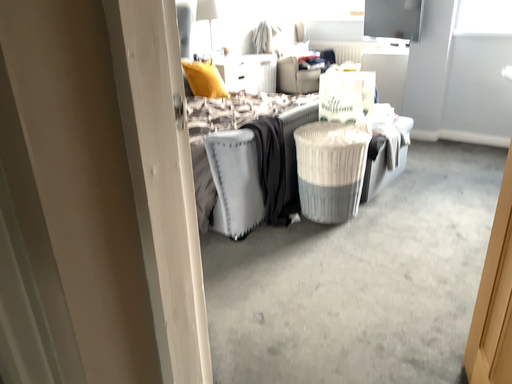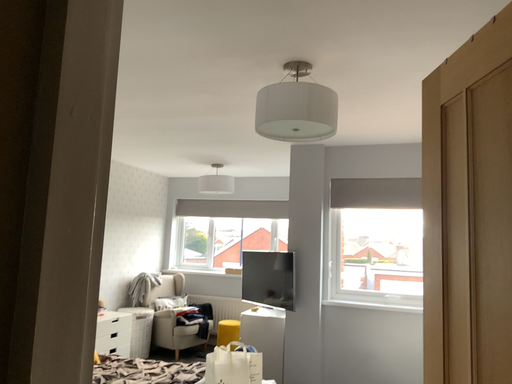
Question: How did the camera likely rotate when shooting the video?

Choices:
 (A) rotated right
 (B) rotated left

Answer: (A)